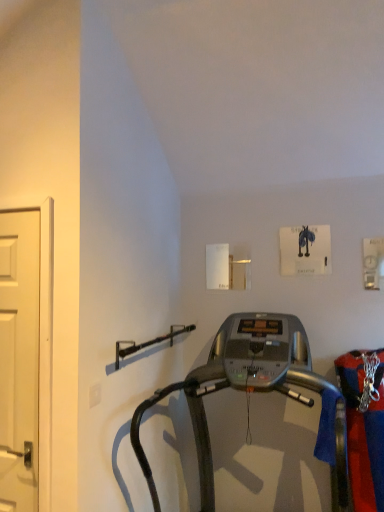
Question: From a real-world perspective, is silver metallic treadmill at center physically located above or below white matte door at left?

Choices:
 (A) above
 (B) below

Answer: (B)

Question: Considering their positions, is silver metallic treadmill at center located in front of or behind white matte door at left?

Choices:
 (A) behind
 (B) front

Answer: (B)

Question: Would you say silver metallic treadmill at center is inside or outside white matte door at left?

Choices:
 (A) inside
 (B) outside

Answer: (B)

Question: From a real-world perspective, is white matte door at left physically located above or below silver metallic treadmill at center?

Choices:
 (A) above
 (B) below

Answer: (A)

Question: Is white matte door at left spatially inside silver metallic treadmill at center, or outside of it?

Choices:
 (A) outside
 (B) inside

Answer: (A)

Question: In the image, is white matte door at left on the left side or the right side of silver metallic treadmill at center?

Choices:
 (A) right
 (B) left

Answer: (B)

Question: Considering the positions of white matte door at left and silver metallic treadmill at center in the image, is white matte door at left wider or thinner than silver metallic treadmill at center?

Choices:
 (A) thin
 (B) wide

Answer: (A)